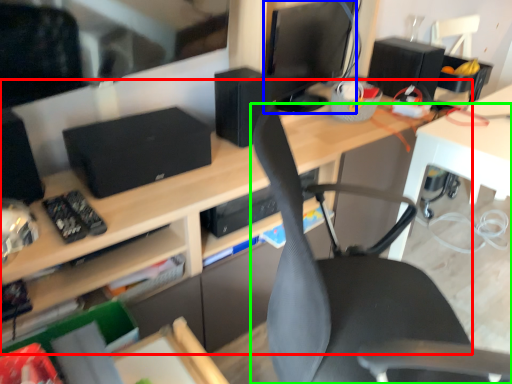
Question: Based on their relative distances, which object is nearer to desk (highlighted by a red box)? Choose from computer monitor (highlighted by a blue box) and chair (highlighted by a green box).

Choices:
 (A) computer monitor
 (B) chair

Answer: (B)